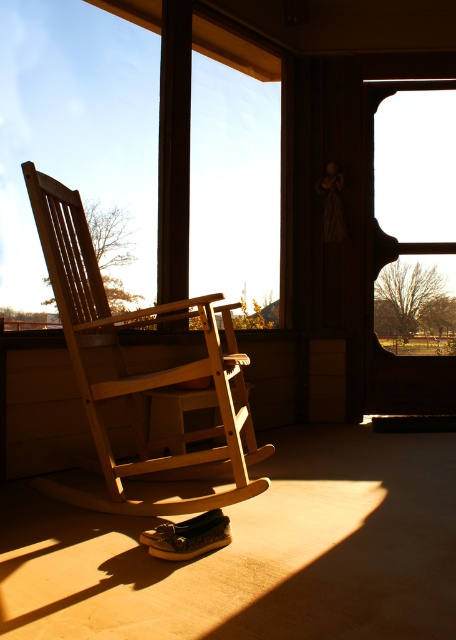
Does transparent glass window at upper center have a larger size compared to light brown wood rocking chair at center?

Yes.

How distant is transparent glass window at upper center from light brown wood rocking chair at center?

transparent glass window at upper center and light brown wood rocking chair at center are 2.77 meters apart from each other.

The image size is (456, 640). What are the coordinates of `transparent glass window at upper center` in the screenshot? It's located at (77, 131).

Find the location of a particular element. This screenshot has height=640, width=456. transparent glass window at upper center is located at coordinates (77, 131).

In the scene shown: Does light brown wood rocking chair at center appear under transparent glass window at center?

Yes.

Does light brown wood rocking chair at center have a lesser width compared to transparent glass window at center?

No, light brown wood rocking chair at center is not thinner than transparent glass window at center.

Is point (171, 381) behind point (371, 236)?

No.

Identify the location of light brown wood rocking chair at center. (135, 374).

Between transparent glass window at upper center and transparent glass window at center, which one has more height?

With more height is transparent glass window at upper center.

Who is higher up, transparent glass window at upper center or transparent glass window at center?

Positioned higher is transparent glass window at upper center.

What do you see at coordinates (77, 131) in the screenshot? I see `transparent glass window at upper center` at bounding box center [77, 131].

The height and width of the screenshot is (640, 456). What are the coordinates of `transparent glass window at upper center` in the screenshot? It's located at (77, 131).